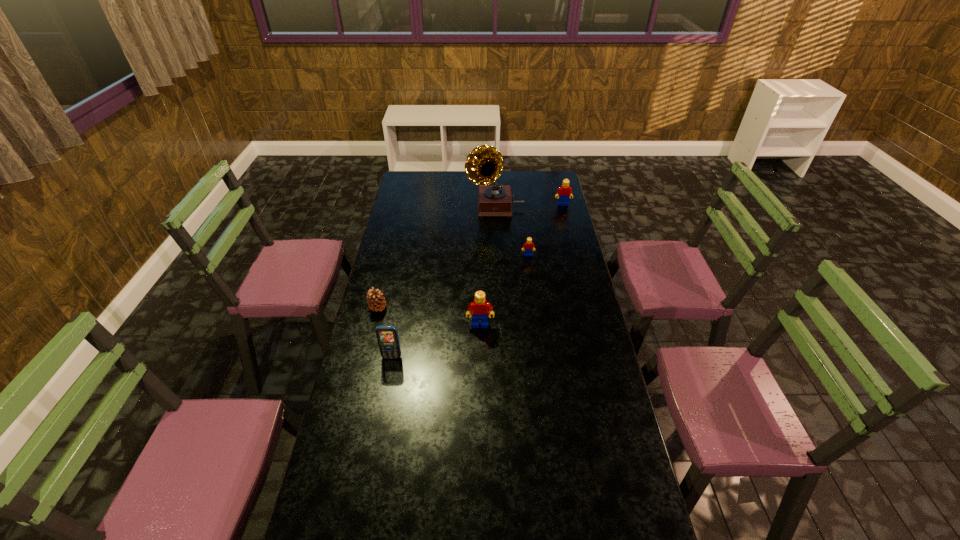
Identify which Lego is the closest to the second tallest Lego. Please provide its 2D coordinates. Your answer should be formatted as a tuple, i.e. [(x, y)], where the tuple contains the x and y coordinates of a point satisfying the conditions above.

[(528, 245)]

Find the location of a particular element. vacant position in the image that satisfies the following two spatial constraints: 1. from the horn of the phonograph record; 2. on the front-facing side of the leftmost Lego is located at coordinates tap(500, 325).

At what (x,y) coordinates should I click in order to perform the action: click on free point that satisfies the following two spatial constraints: 1. from the horn of the phonograph record; 2. on the front side of the pinecone. Please return your answer as a coordinate pair (x, y). The height and width of the screenshot is (540, 960). Looking at the image, I should click on (499, 308).